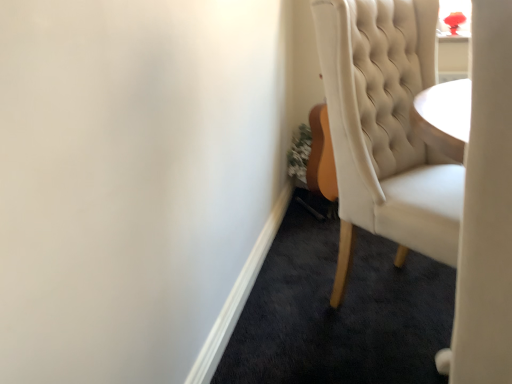
What is the approximate width of matte cream chair at right?

16.37 inches.

In order to face matte cream chair at right, should I rotate leftwards or rightwards?

To align with it, rotate right about 19.020°.

Describe the element at coordinates (385, 129) in the screenshot. I see `matte cream chair at right` at that location.

You are a GUI agent. You are given a task and a screenshot of the screen. Output one action in this format:
    pyautogui.click(x=<x>, y=<y>)
    Task: Click on the matte cream chair at right
    The height and width of the screenshot is (384, 512).
    Given the screenshot: What is the action you would take?
    pyautogui.click(x=385, y=129)

Find the location of a particular element. matte cream chair at right is located at coordinates (385, 129).